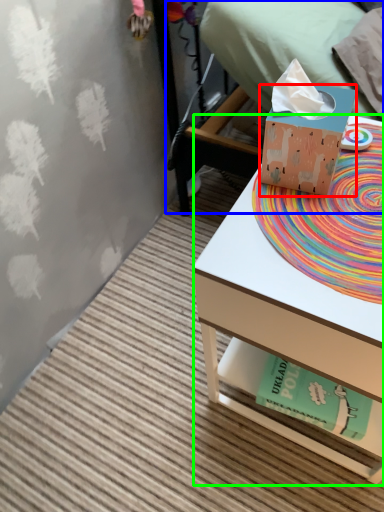
Question: Considering the real-world distances, which object is closest to box (highlighted by a red box)? bed (highlighted by a blue box) or desk (highlighted by a green box).

Choices:
 (A) bed
 (B) desk

Answer: (B)